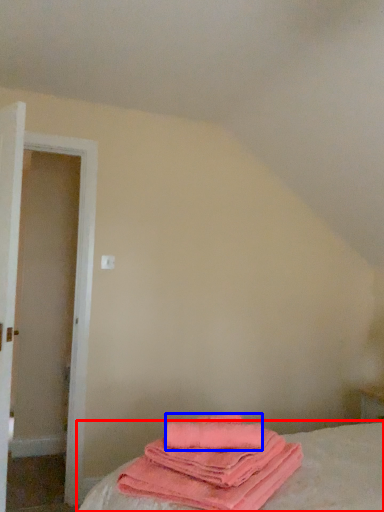
Question: Among these objects, which one is nearest to the camera, bed (highlighted by a red box) or beach towel (highlighted by a blue box)?

Choices:
 (A) bed
 (B) beach towel

Answer: (A)